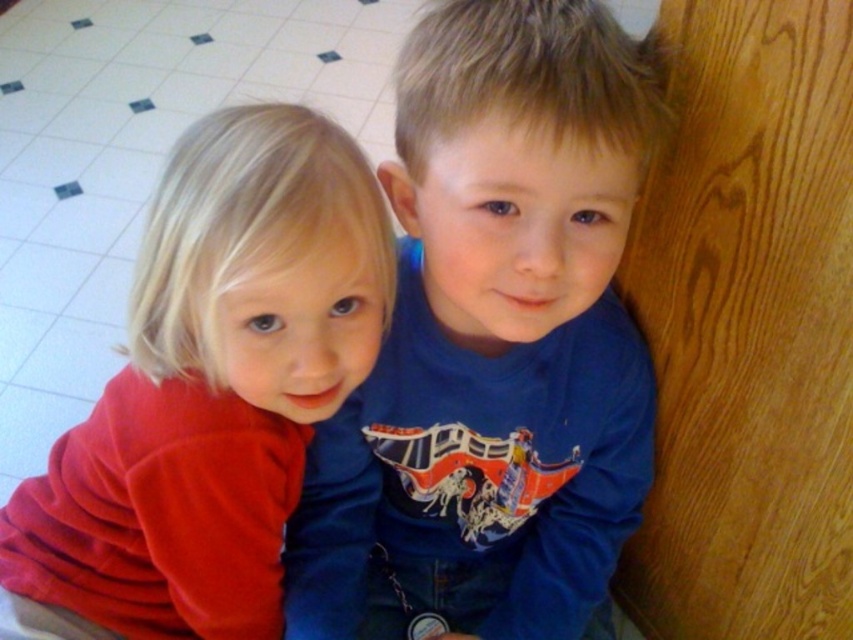
Which is behind, point (497, 285) or point (355, 196)?

Positioned behind is point (497, 285).

Can you confirm if blue cotton shirt at center is smaller than matte red shirt at left?

No, blue cotton shirt at center is not smaller than matte red shirt at left.

Is point (560, 465) in front of point (276, 256)?

No.

You are a GUI agent. You are given a task and a screenshot of the screen. Output one action in this format:
    pyautogui.click(x=<x>, y=<y>)
    Task: Click on the blue cotton shirt at center
    This screenshot has height=640, width=853.
    Given the screenshot: What is the action you would take?
    pyautogui.click(x=492, y=346)